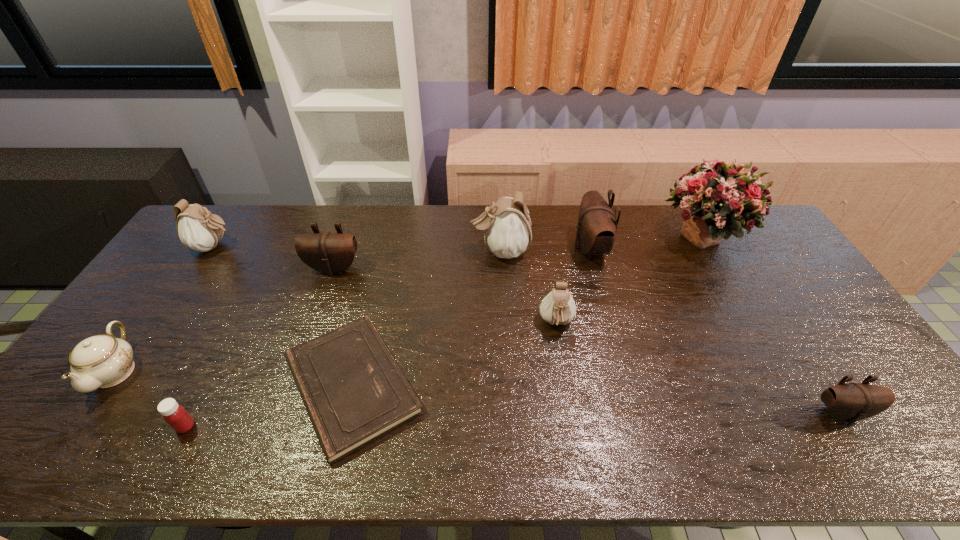
Where is `vacant region located 0.210m on the front-facing side of the biggest white pouch`? This screenshot has height=540, width=960. vacant region located 0.210m on the front-facing side of the biggest white pouch is located at coordinates (409, 251).

Locate an element on the screen. The height and width of the screenshot is (540, 960). free space located with the flap open on the third object from right to left is located at coordinates (541, 248).

At what (x,y) coordinates should I click in order to perform the action: click on blank area located with the flap open on the third object from right to left. Please return your answer as a coordinate pair (x, y). The width and height of the screenshot is (960, 540). Looking at the image, I should click on point(553,248).

The width and height of the screenshot is (960, 540). Identify the location of vacant space located with the flap open on the third object from right to left. (463, 248).

In order to click on vacant space positioned on the front-facing side of the leftmost white pouch in this screenshot , I will do `click(293, 247)`.

The width and height of the screenshot is (960, 540). In order to click on vacant space located 0.330m with the flap open on the leftmost brown pouch in this screenshot , I will do `click(300, 364)`.

Locate an element on the screen. The height and width of the screenshot is (540, 960). free space located on the front-facing side of the smallest white pouch is located at coordinates (573, 428).

Identify the location of blank space located 0.140m at the spout of the chinaware. This screenshot has width=960, height=540. (53, 461).

This screenshot has height=540, width=960. Find the location of `free space located with the flap open on the nearest pouch`. free space located with the flap open on the nearest pouch is located at coordinates (874, 465).

The height and width of the screenshot is (540, 960). Find the location of `blank space located on the back of the red medicine`. blank space located on the back of the red medicine is located at coordinates (225, 350).